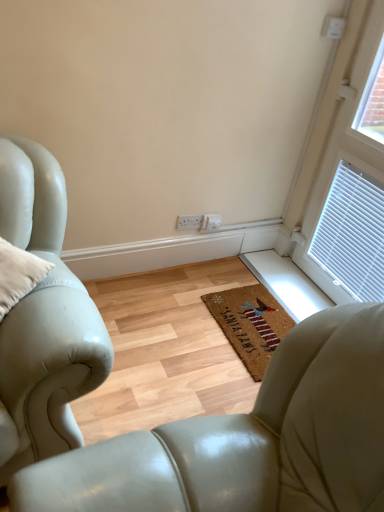
Question: Relative to white plastic window at upper right, is leather armchair at center in front or behind?

Choices:
 (A) behind
 (B) front

Answer: (B)

Question: In the image, is leather armchair at center on the left side or the right side of white plastic window at upper right?

Choices:
 (A) left
 (B) right

Answer: (A)

Question: Which object is positioned farthest from the leather armchair at center?

Choices:
 (A) coir mat at center
 (B) white plastic window at upper right

Answer: (B)

Question: Which is farther from the coir mat at center?

Choices:
 (A) leather armchair at center
 (B) white plastic window at upper right

Answer: (A)